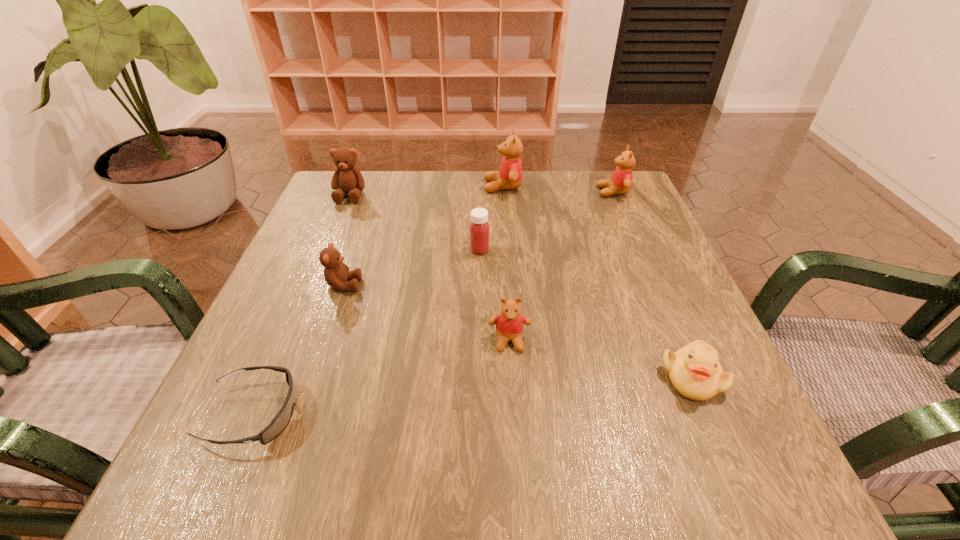
At what (x,y) coordinates should I click in order to perform the action: click on vacant area that satisfies the following two spatial constraints: 1. on the front-facing side of the tallest object; 2. on the face of the farther brown teddy bear. Please return your answer as a coordinate pair (x, y). This screenshot has width=960, height=540. Looking at the image, I should click on (503, 195).

Identify the location of vacant space that satisfies the following two spatial constraints: 1. on the front-facing side of the nearest red teddy bear; 2. on the lenses of the goggles. This screenshot has height=540, width=960. (515, 414).